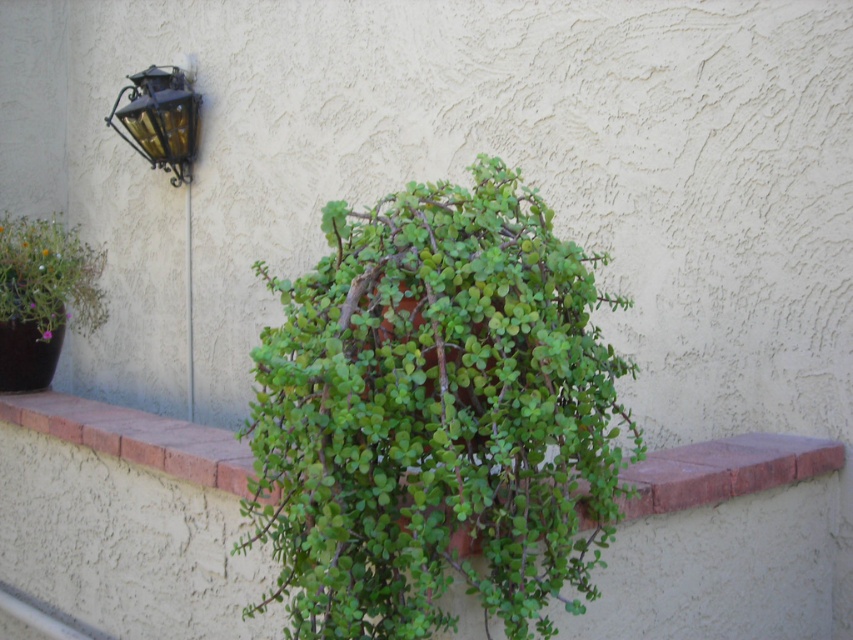
Question: Among these points, which one is farthest from the camera?

Choices:
 (A) (405, 544)
 (B) (9, 234)

Answer: (B)

Question: Which object is positioned closest to the matte purple flower pot at left?

Choices:
 (A) green matte plant at center
 (B) gold textured lantern at upper left

Answer: (B)

Question: Is green matte plant at center above matte purple flower pot at left?

Choices:
 (A) no
 (B) yes

Answer: (A)

Question: Can you confirm if matte purple flower pot at left is thinner than gold textured lantern at upper left?

Choices:
 (A) no
 (B) yes

Answer: (A)

Question: Which object is farther from the camera taking this photo?

Choices:
 (A) gold textured lantern at upper left
 (B) green matte plant at center
 (C) matte purple flower pot at left

Answer: (A)

Question: From the image, what is the correct spatial relationship of green matte plant at center in relation to gold textured lantern at upper left?

Choices:
 (A) left
 (B) right

Answer: (B)